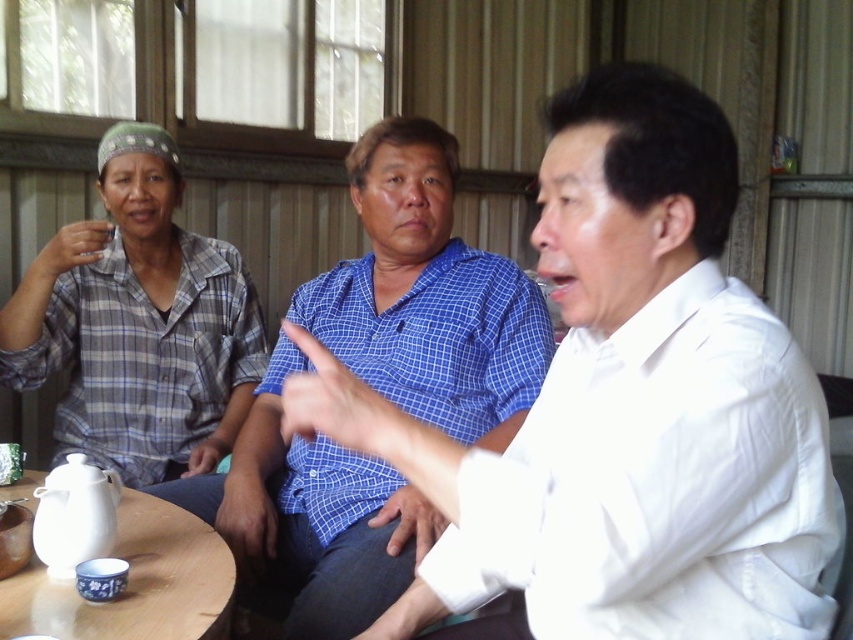
What are the coordinates of the white cotton shirt at center in the image?

The white cotton shirt at center is located at coordinates (622, 410).

Based on the scene description, which of the two individuals is sitting closer to the front? The white cotton shirt at center or the blue checkered shirt at center?

The white cotton shirt at center is sitting closer to the front because it is positioned under the blue checkered shirt at center, meaning it is in a lower, more forward position in the image.